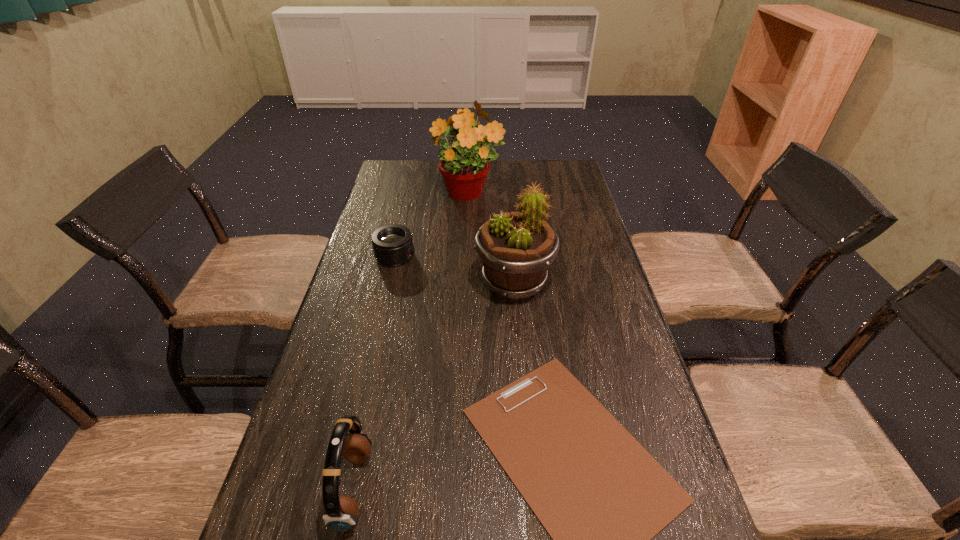
At what (x,y) coordinates should I click in order to perform the action: click on empty space between the farther flowerpot and the fourth tallest object. Please return your answer as a coordinate pair (x, y). This screenshot has height=540, width=960. Looking at the image, I should click on (432, 226).

Where is `vacant space that's between the nearer flowerpot and the second shortest object`? The image size is (960, 540). vacant space that's between the nearer flowerpot and the second shortest object is located at coordinates pyautogui.click(x=455, y=269).

Image resolution: width=960 pixels, height=540 pixels. What are the coordinates of `object that can be found as the closest to the farther flowerpot` in the screenshot? It's located at (392, 244).

This screenshot has height=540, width=960. In order to click on the closest object to the third tallest object in this screenshot , I will do `click(601, 497)`.

The image size is (960, 540). In order to click on vacant space that satisfies the following two spatial constraints: 1. on the front side of the nearer flowerpot; 2. on the ear cup of the headset in this screenshot , I will do `click(532, 488)`.

Find the location of a particular element. The height and width of the screenshot is (540, 960). vacant space that satisfies the following two spatial constraints: 1. on the front side of the nearer flowerpot; 2. on the ear cup of the headset is located at coordinates (532, 488).